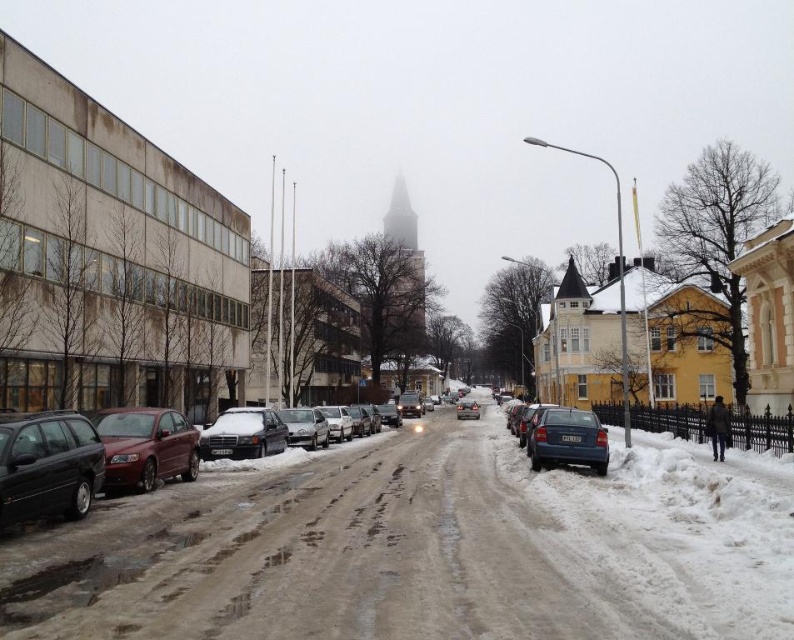
You are a delivery person needing to load a large package into the trunk of a car. You have two options in the image, the sleek black sedan at center and the matte black sedan at center. Which car would allow you to load the package more easily based on their heights?

The sleek black sedan at center has a lesser height compared to the matte black sedan at center, so the sleek black sedan at center would allow you to load the package more easily since its lower height makes accessing the trunk simpler.

You are a delivery driver trying to park your sleek black sedan at center in a tight space. There is also a matte black sedan at center nearby. Which car takes up more space and might make parking difficult?

The matte black sedan at center occupies more space than the sleek black sedan at center, so it might make parking more difficult.